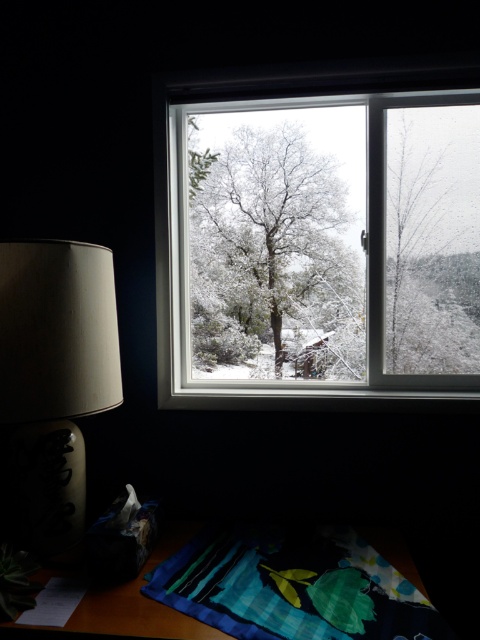
Who is taller, snow-covered tree at center or snow-covered tree at right?

snow-covered tree at center

Can you confirm if snow-covered tree at center is smaller than snow-covered tree at right?

Actually, snow-covered tree at center might be larger than snow-covered tree at right.

Between point (255, 262) and point (476, 209), which one is positioned in front?

Point (476, 209) is more forward.

Where is `snow-covered tree at center`? snow-covered tree at center is located at coordinates (276, 259).

Can you confirm if clear glass window at center is positioned above blue plaid blanket at lower center?

Yes.

Who is more forward, (423, 230) or (369, 560)?

Point (369, 560)

Image resolution: width=480 pixels, height=640 pixels. What are the coordinates of `clear glass window at center` in the screenshot? It's located at (320, 250).

Is clear glass window at center taller than snow-covered tree at right?

Yes, clear glass window at center is taller than snow-covered tree at right.

How far apart are clear glass window at center and snow-covered tree at right?

clear glass window at center and snow-covered tree at right are 6.80 inches apart.

The image size is (480, 640). Describe the element at coordinates (320, 250) in the screenshot. I see `clear glass window at center` at that location.

You are a GUI agent. You are given a task and a screenshot of the screen. Output one action in this format:
    pyautogui.click(x=<x>, y=<y>)
    Task: Click on the clear glass window at center
    
    Given the screenshot: What is the action you would take?
    pyautogui.click(x=320, y=250)